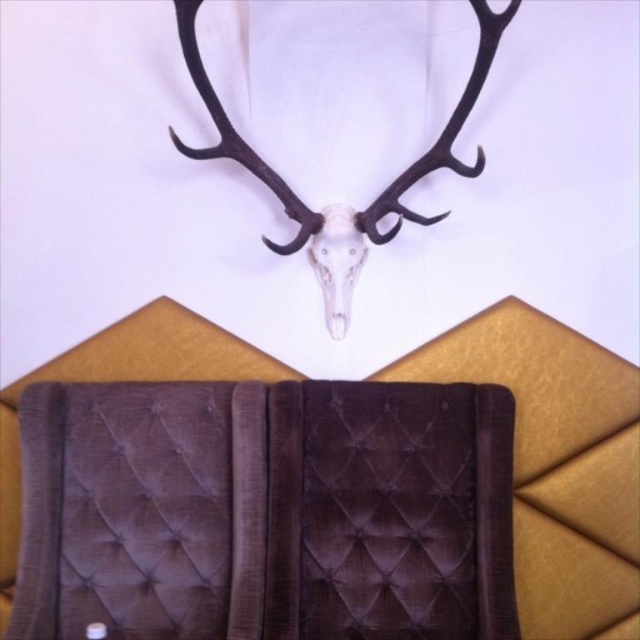
Question: Observing the image, what is the correct spatial positioning of black matte antler at upper center in reference to white matte skull at center?

Choices:
 (A) right
 (B) left

Answer: (A)

Question: Does black matte antler at upper center have a greater width compared to white matte skull at center?

Choices:
 (A) no
 (B) yes

Answer: (B)

Question: Does black matte antler at upper center have a greater width compared to white matte skull at center?

Choices:
 (A) no
 (B) yes

Answer: (B)

Question: Which point is farther to the camera?

Choices:
 (A) (301, 232)
 (B) (326, 244)

Answer: (B)

Question: Among these points, which one is nearest to the camera?

Choices:
 (A) [326, 268]
 (B) [236, 147]

Answer: (B)

Question: Which point is farther to the camera?

Choices:
 (A) black matte antler at upper center
 (B) white matte skull at center

Answer: (B)